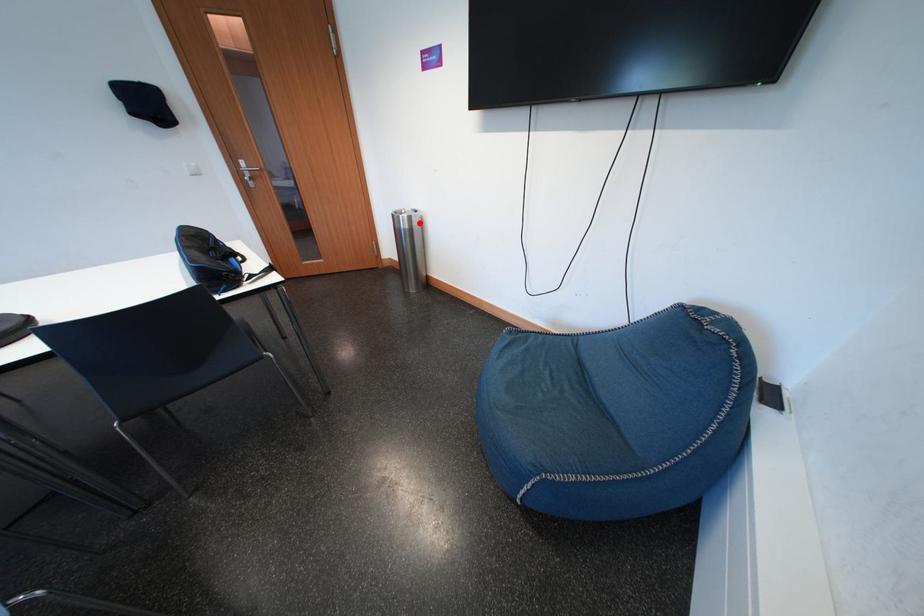
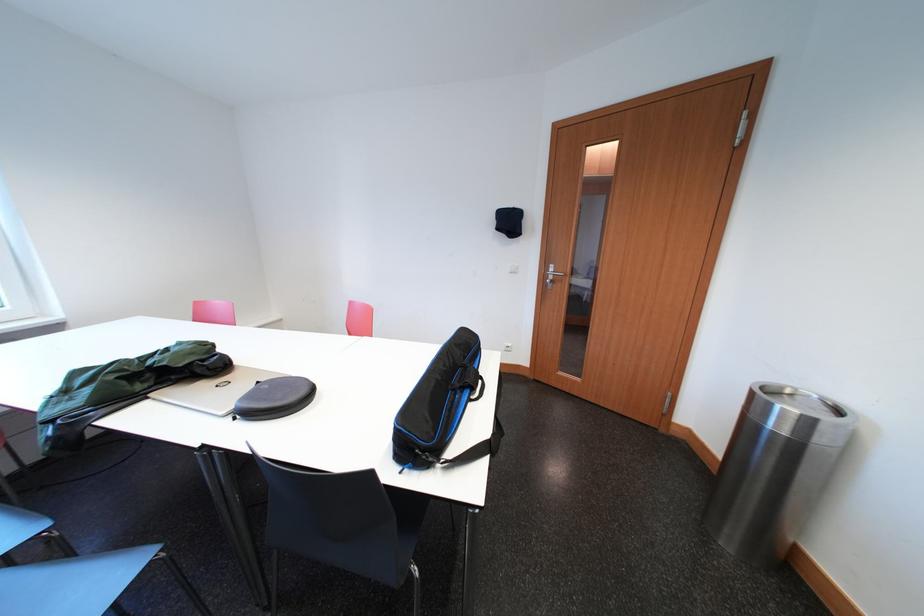
Question: I am providing you with two images of the same scene from different viewpoints. Given a red point in image1, look at the same physical point in image2. Is it:

Choices:
 (A) Closer to the viewpoint
 (B) Farther from the viewpoint

Answer: (B)